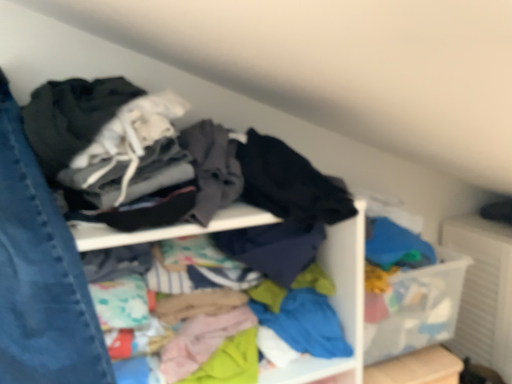
Question: Is denim at left inside the boundaries of multicolored fabric at center, or outside?

Choices:
 (A) outside
 (B) inside

Answer: (A)

Question: From a real-world perspective, relative to multicolored fabric at center, is denim at left vertically above or below?

Choices:
 (A) above
 (B) below

Answer: (A)

Question: From the image's perspective, relative to multicolored fabric at center, is denim at left above or below?

Choices:
 (A) above
 (B) below

Answer: (A)

Question: From a real-world perspective, is multicolored fabric at center positioned above or below denim at left?

Choices:
 (A) above
 (B) below

Answer: (B)

Question: Is point (266, 377) closer or farther from the camera than point (39, 329)?

Choices:
 (A) farther
 (B) closer

Answer: (A)

Question: Is multicolored fabric at center inside or outside of denim at left?

Choices:
 (A) inside
 (B) outside

Answer: (B)

Question: Is multicolored fabric at center to the left or to the right of denim at left in the image?

Choices:
 (A) left
 (B) right

Answer: (B)